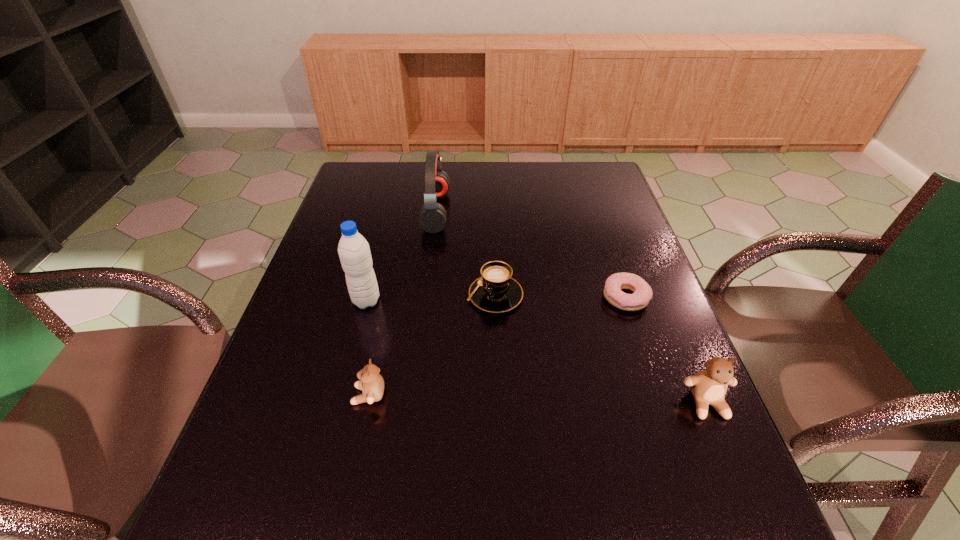
Please point a location where one more teddy_bear can be added evenly. Please provide its 2D coordinates. Your answer should be formatted as a tuple, i.e. [(x, y)], where the tuple contains the x and y coordinates of a point satisfying the conditions above.

[(537, 399)]